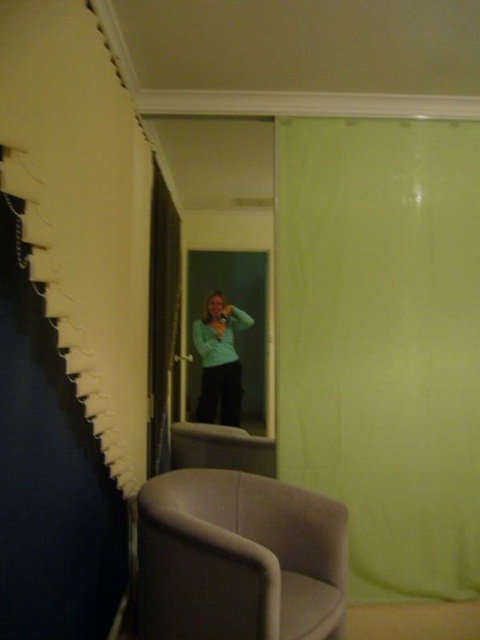
Question: Among these points, which one is nearest to the camera?

Choices:
 (A) (216, 310)
 (B) (334, 282)

Answer: (B)

Question: Which point is farther to the camera?

Choices:
 (A) (203, 392)
 (B) (450, 369)

Answer: (A)

Question: Can you confirm if dark gray leather armchair at lower center is positioned to the right of green matte shirt at center?

Choices:
 (A) no
 (B) yes

Answer: (B)

Question: Which point is farther from the camera taking this photo?

Choices:
 (A) (168, 625)
 (B) (155, 320)

Answer: (B)

Question: Does green fabric curtain at center appear under green matte shirt at center?

Choices:
 (A) no
 (B) yes

Answer: (B)

Question: Can you confirm if dark gray leather armchair at lower center is wider than black velvet curtain at center?

Choices:
 (A) no
 (B) yes

Answer: (B)